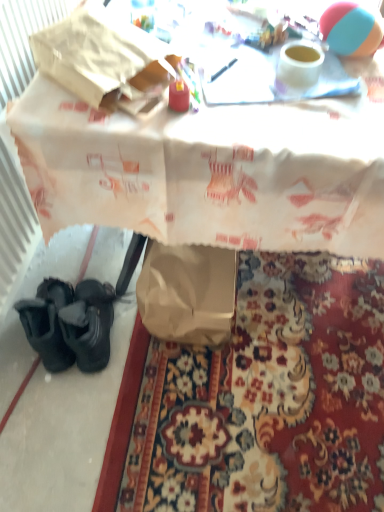
Question: From the image's perspective, is white paper bag at lower left over brown paper bag at lower left?

Choices:
 (A) yes
 (B) no

Answer: (A)

Question: Can you confirm if white paper bag at lower left is thinner than brown paper bag at lower left?

Choices:
 (A) no
 (B) yes

Answer: (A)

Question: Is white paper bag at lower left aimed at brown paper bag at lower left?

Choices:
 (A) yes
 (B) no

Answer: (A)

Question: Is white paper bag at lower left positioned before brown paper bag at lower left?

Choices:
 (A) yes
 (B) no

Answer: (A)

Question: Does white paper bag at lower left touch brown paper bag at lower left?

Choices:
 (A) yes
 (B) no

Answer: (B)

Question: Can you confirm if white paper bag at lower left is shorter than brown paper bag at lower left?

Choices:
 (A) yes
 (B) no

Answer: (B)

Question: Considering the relative sizes of rubber beach ball at upper right and brown paper bag at lower left in the image provided, is rubber beach ball at upper right thinner than brown paper bag at lower left?

Choices:
 (A) yes
 (B) no

Answer: (A)

Question: From the image's perspective, does rubber beach ball at upper right appear lower than brown paper bag at lower left?

Choices:
 (A) no
 (B) yes

Answer: (A)

Question: Is rubber beach ball at upper right beside brown paper bag at lower left?

Choices:
 (A) no
 (B) yes

Answer: (A)

Question: Is brown paper bag at lower left completely or partially inside rubber beach ball at upper right?

Choices:
 (A) no
 (B) yes

Answer: (A)

Question: Is rubber beach ball at upper right positioned beyond the bounds of brown paper bag at lower left?

Choices:
 (A) no
 (B) yes

Answer: (B)

Question: Does rubber beach ball at upper right have a smaller size compared to brown paper bag at lower left?

Choices:
 (A) yes
 (B) no

Answer: (A)

Question: Is the depth of white paper bag at lower left greater than that of rubber beach ball at upper right?

Choices:
 (A) yes
 (B) no

Answer: (B)